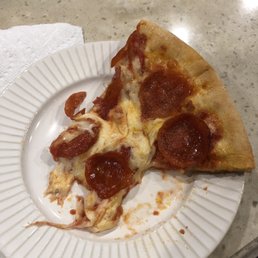
I want to click on napkin, so click(58, 44).